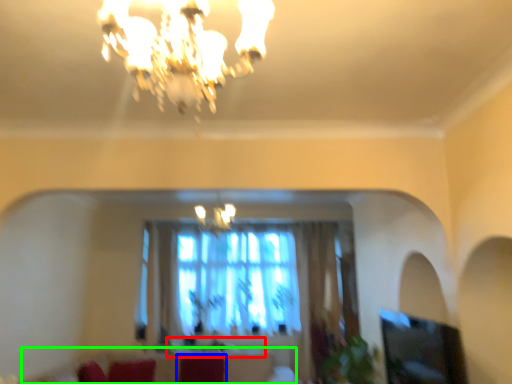
Question: Which object is the closest to the round table (highlighted by a red box)? Choose among these: swivel chair (highlighted by a blue box) or couch (highlighted by a green box).

Choices:
 (A) swivel chair
 (B) couch

Answer: (B)